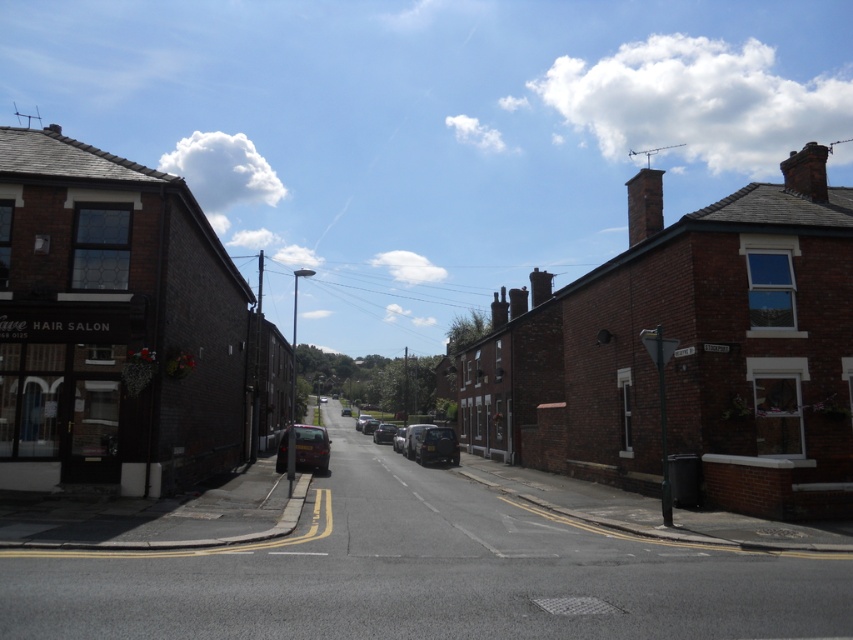
You are a delivery driver who needs to park your vehicle in the parking spot that can only accommodate vehicles up to the size of the shiny silver car at center. You are driving a truck that is the same size as the metallic silver van at center. Can you park your truck in that spot?

The metallic silver van at center is bigger than the shiny silver car at center. Since your truck is the same size as the metallic silver van at center, it is larger than the maximum allowed size for the parking spot. Therefore, you cannot park your truck there.

You are a pedestrian standing at the crosswalk and see both the metallic silver car at center and the shiny silver car at center. Which car is closer to you?

The metallic silver car at center is closer to you because it is in front of the shiny silver car at center.